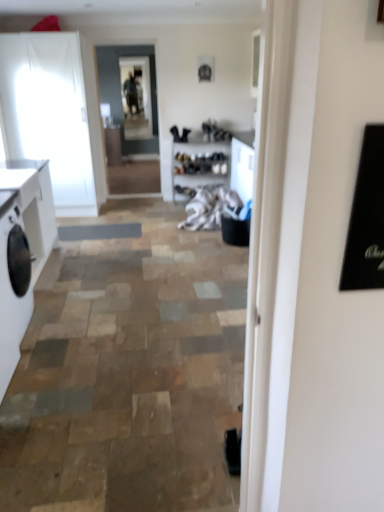
Describe the element at coordinates (55, 114) in the screenshot. I see `white glossy cabinet at left, the second cabinetry viewed from the front` at that location.

This screenshot has height=512, width=384. Identify the location of white fabric at center. (210, 207).

Where is `white glossy counter top at left`? This screenshot has height=512, width=384. white glossy counter top at left is located at coordinates (25, 179).

This screenshot has width=384, height=512. I want to click on white matte cabinet at left, acting as the first cabinetry starting from the bottom, so click(33, 205).

Which is more to the left, white matte washing machine at left or clear glass window screen at center?

From the viewer's perspective, white matte washing machine at left appears more on the left side.

From the picture: Does white matte washing machine at left have a lesser height compared to clear glass window screen at center?

Yes.

Is white matte washing machine at left oriented away from clear glass window screen at center?

white matte washing machine at left does not have its back to clear glass window screen at center.

How many degrees apart are the facing directions of white glossy counter top at left and white fabric at center?

There is a 180-degree angle between the facing directions of white glossy counter top at left and white fabric at center.

Is white glossy counter top at left turned away from white fabric at center?

No, white fabric at center is not at the back of white glossy counter top at left.

Considering the relative sizes of white glossy counter top at left and white fabric at center in the image provided, is white glossy counter top at left taller than white fabric at center?

No, white glossy counter top at left is not taller than white fabric at center.

From a real-world perspective, is white glossy counter top at left physically located above or below white matte cabinet at left, marked as the first cabinetry in a front-to-back arrangement?

Clearly, from a real-world perspective, white glossy counter top at left is above white matte cabinet at left, marked as the first cabinetry in a front-to-back arrangement.

From the image's perspective, between white glossy counter top at left and white matte cabinet at left, acting as the first cabinetry starting from the bottom, which one is located above?

white glossy counter top at left, from the image's perspective.

Is white glossy counter top at left far away from white matte cabinet at left, acting as the second cabinetry starting from the top?

No, white glossy counter top at left is not far from white matte cabinet at left, acting as the second cabinetry starting from the top.

Which of these two, white glossy counter top at left or white matte cabinet at left, the second cabinetry when ordered from back to front, is thinner?

white glossy counter top at left is thinner.

Considering the relative positions of clear glass window screen at center and white matte cabinet at left, the second cabinetry when ordered from back to front, in the image provided, is clear glass window screen at center in front of white matte cabinet at left, the second cabinetry when ordered from back to front,?

No, it is behind white matte cabinet at left, the second cabinetry when ordered from back to front.

Considering the relative sizes of clear glass window screen at center and white matte cabinet at left, marked as the first cabinetry in a front-to-back arrangement, in the image provided, is clear glass window screen at center wider than white matte cabinet at left, marked as the first cabinetry in a front-to-back arrangement,?

In fact, clear glass window screen at center might be narrower than white matte cabinet at left, marked as the first cabinetry in a front-to-back arrangement.

Considering the positions of point (139, 88) and point (21, 166), is point (139, 88) closer or farther from the camera than point (21, 166)?

Point (139, 88).

From a real-world perspective, relative to white matte cabinet at left, marked as the first cabinetry in a front-to-back arrangement, is clear glass window screen at center vertically above or below?

Clearly, from a real-world perspective, clear glass window screen at center is above white matte cabinet at left, marked as the first cabinetry in a front-to-back arrangement.

Could you tell me if white matte washing machine at left is turned towards white glossy cabinet at left, the 1th cabinetry in the top-to-bottom sequence?

No, white matte washing machine at left does not turn towards white glossy cabinet at left, the 1th cabinetry in the top-to-bottom sequence.

How different are the orientations of white matte washing machine at left and white glossy cabinet at left, which appears as the second cabinetry when ordered from the bottom, in degrees?

white matte washing machine at left and white glossy cabinet at left, which appears as the second cabinetry when ordered from the bottom, are facing 91.8 degrees away from each other.

Does white matte washing machine at left have a lesser width compared to white glossy cabinet at left, positioned as the first cabinetry in back-to-front order?

Indeed, white matte washing machine at left has a lesser width compared to white glossy cabinet at left, positioned as the first cabinetry in back-to-front order.

From a real-world perspective, is white matte washing machine at left located beneath white glossy cabinet at left, the second cabinetry viewed from the front?

Yes, from a real-world perspective, white matte washing machine at left is under white glossy cabinet at left, the second cabinetry viewed from the front.

At what (x,y) coordinates should I click in order to perform the action: click on glass door on the right of white matte washing machine at left. Please return your answer as a coordinate pair (x, y). Looking at the image, I should click on (120, 92).

Who is more distant, white matte washing machine at left or clear glass door at center?

clear glass door at center.

Is white matte washing machine at left oriented away from clear glass door at center?

No, clear glass door at center is not at the back of white matte washing machine at left.

Between clear glass door at center and clear glass window screen at center, which one has smaller width?

With smaller width is clear glass window screen at center.

Does clear glass door at center contain clear glass window screen at center?

No.

Is clear glass door at center at the left side of clear glass window screen at center?

In fact, clear glass door at center is to the right of clear glass window screen at center.

Can you confirm if clear glass door at center is smaller than clear glass window screen at center?

No.

Identify the location of window screen that is above the white matte washing machine at left (from the image's perspective). The height and width of the screenshot is (512, 384). (137, 98).

Identify the location of counter top located below the white fabric at center (from the image's perspective). (25, 179).

Estimate the real-world distances between objects in this image. Which object is further from white fabric at center, clear glass window screen at center or clear glass door at center?

clear glass window screen at center is further to white fabric at center.

Looking at the image, which one is located further to white glossy cabinet at left, the 1th cabinetry in the top-to-bottom sequence, white glossy counter top at left or clear glass door at center?

Based on the image, white glossy counter top at left appears to be further to white glossy cabinet at left, the 1th cabinetry in the top-to-bottom sequence.

Considering their positions, is white matte washing machine at left positioned closer to white fabric at center than white matte cabinet at left, marked as the first cabinetry in a front-to-back arrangement?

white matte cabinet at left, marked as the first cabinetry in a front-to-back arrangement, lies closer to white fabric at center than the other object.

Based on their spatial positions, is white matte washing machine at left or clear glass window screen at center further from clear glass door at center?

white matte washing machine at left lies further to clear glass door at center than the other object.

Which object lies further to the anchor point white glossy cabinet at left, which appears as the second cabinetry when ordered from the bottom, white glossy counter top at left or clear glass window screen at center?

clear glass window screen at center lies further to white glossy cabinet at left, which appears as the second cabinetry when ordered from the bottom, than the other object.

Estimate the real-world distances between objects in this image. Which object is closer to white fabric at center, white glossy cabinet at left, which appears as the second cabinetry when ordered from the bottom, or clear glass door at center?

clear glass door at center lies closer to white fabric at center than the other object.

From the image, which object appears to be farther from white matte washing machine at left, white fabric at center or clear glass window screen at center?

The object further to white matte washing machine at left is clear glass window screen at center.

Which object lies nearer to the anchor point white glossy cabinet at left, which appears as the second cabinetry when ordered from the bottom, white fabric at center or clear glass door at center?

Among the two, clear glass door at center is located nearer to white glossy cabinet at left, which appears as the second cabinetry when ordered from the bottom.

Find the location of `glass door located between white fabric at center and clear glass window screen at center in the depth direction`. glass door located between white fabric at center and clear glass window screen at center in the depth direction is located at coordinates (120, 92).

Where is `cabinetry positioned between white glossy counter top at left and clear glass door at center from near to far`? cabinetry positioned between white glossy counter top at left and clear glass door at center from near to far is located at coordinates (55, 114).

Where is `counter top between white matte washing machine at left and white glossy cabinet at left, the 1th cabinetry in the top-to-bottom sequence, in the front-back direction`? counter top between white matte washing machine at left and white glossy cabinet at left, the 1th cabinetry in the top-to-bottom sequence, in the front-back direction is located at coordinates (25, 179).

Locate an element on the screen. The height and width of the screenshot is (512, 384). counter top between white matte cabinet at left, acting as the second cabinetry starting from the top, and white glossy cabinet at left, the second cabinetry viewed from the front, along the z-axis is located at coordinates coord(25,179).